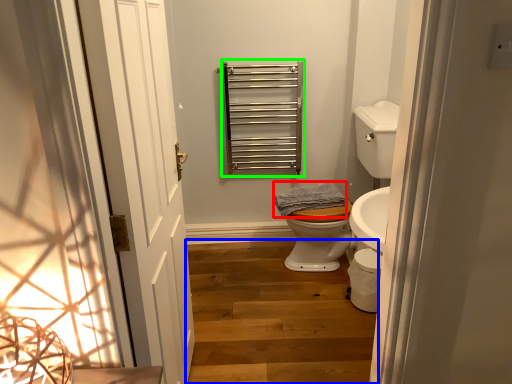
Question: Which object is positioned farthest from material (highlighted by a red box)? Select from stairs (highlighted by a blue box) and balustrade (highlighted by a green box).

Choices:
 (A) stairs
 (B) balustrade

Answer: (A)